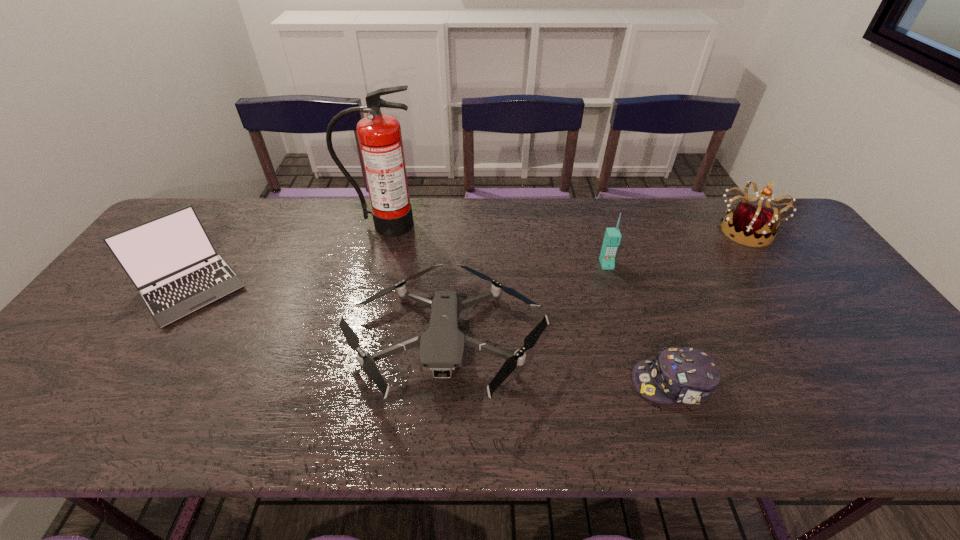
Where is `vacant area situated 0.160m on the front-facing side of the shortest object`? This screenshot has width=960, height=540. vacant area situated 0.160m on the front-facing side of the shortest object is located at coordinates (562, 383).

At what (x,y) coordinates should I click in order to perform the action: click on vacant space located 0.080m on the front-facing side of the shortest object. Please return your answer as a coordinate pair (x, y). The height and width of the screenshot is (540, 960). Looking at the image, I should click on (597, 383).

The height and width of the screenshot is (540, 960). What are the coordinates of `vacant space located 0.080m on the front-facing side of the shortest object` in the screenshot? It's located at (597, 383).

You are a GUI agent. You are given a task and a screenshot of the screen. Output one action in this format:
    pyautogui.click(x=<x>, y=<y>)
    Task: Click on the fire extinguisher positioned at the far edge
    
    Given the screenshot: What is the action you would take?
    pyautogui.click(x=380, y=139)

Identify the location of tiara that is positioned at the far edge. (749, 225).

At what (x,y) coordinates should I click in order to perform the action: click on drone at the near edge. Please return your answer as a coordinate pair (x, y). The width and height of the screenshot is (960, 540). Looking at the image, I should click on (442, 346).

The height and width of the screenshot is (540, 960). Find the location of `headwear that is positioned at the near edge`. headwear that is positioned at the near edge is located at coordinates (687, 375).

Locate an element on the screen. This screenshot has width=960, height=540. object present at the left edge is located at coordinates (170, 251).

I want to click on object at the right edge, so click(x=749, y=225).

Identify the location of object that is at the far right corner. The height and width of the screenshot is (540, 960). (749, 225).